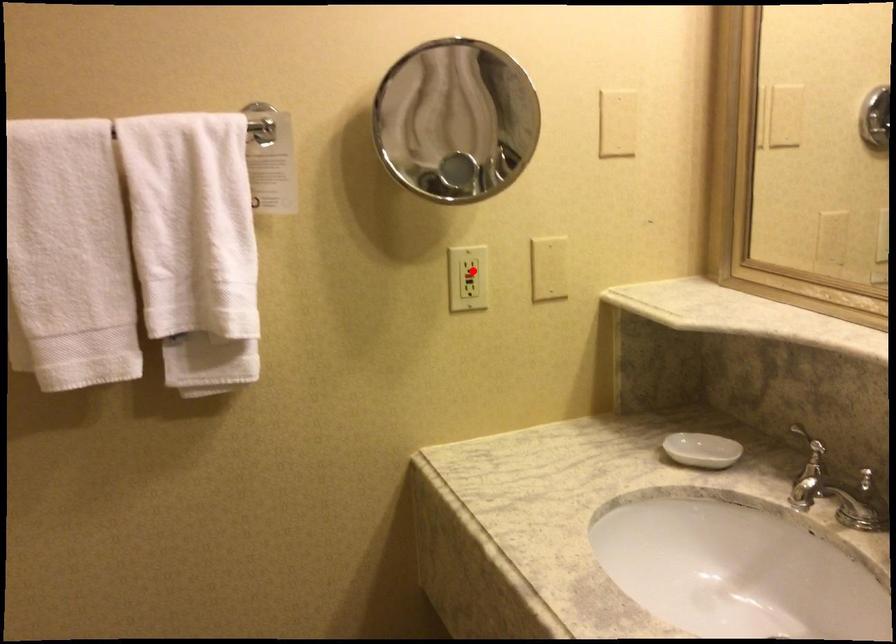
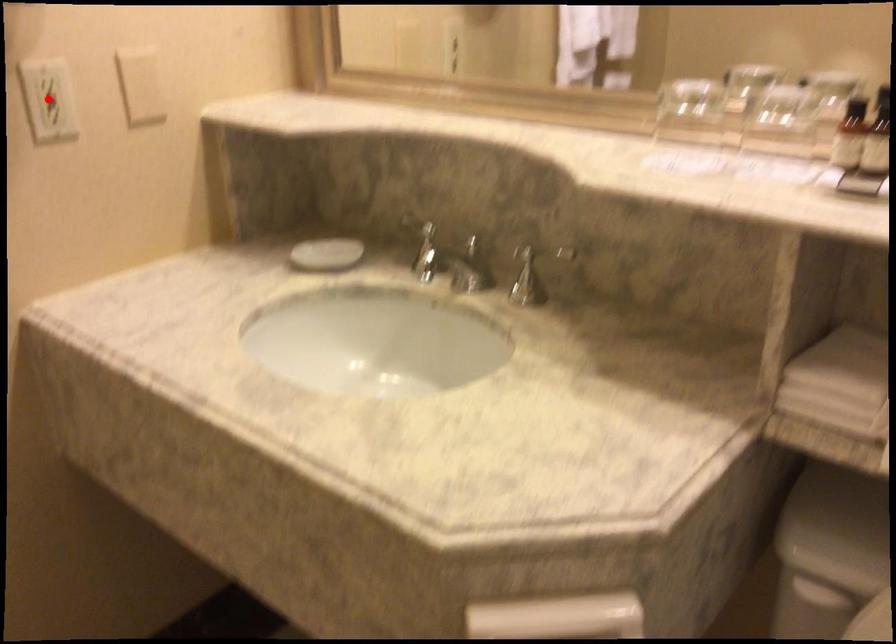
I am providing you with two images of the same scene from different viewpoints. A red point is marked on the first image and another point is marked on the second image. Does the point marked in image1 correspond to the same location as the one in image2?

Yes